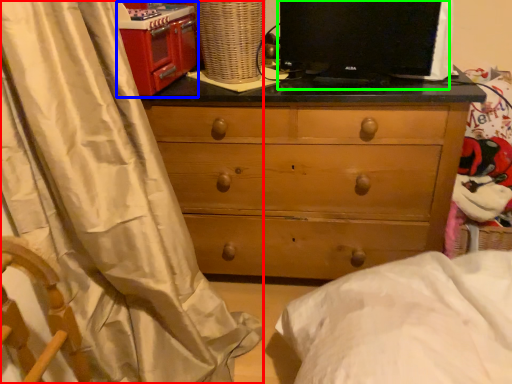
Question: Based on their relative distances, which object is farther from curtain (highlighted by a red box)? Choose from appliance (highlighted by a blue box) and computer monitor (highlighted by a green box).

Choices:
 (A) appliance
 (B) computer monitor

Answer: (B)